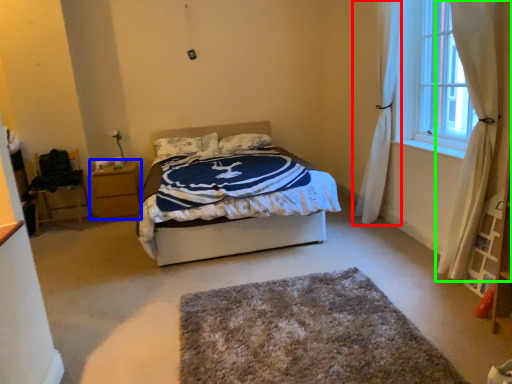
Question: Estimate the real-world distances between objects in this image. Which object is farther from curtain (highlighted by a red box), nightstand (highlighted by a blue box) or curtain (highlighted by a green box)?

Choices:
 (A) nightstand
 (B) curtain

Answer: (A)